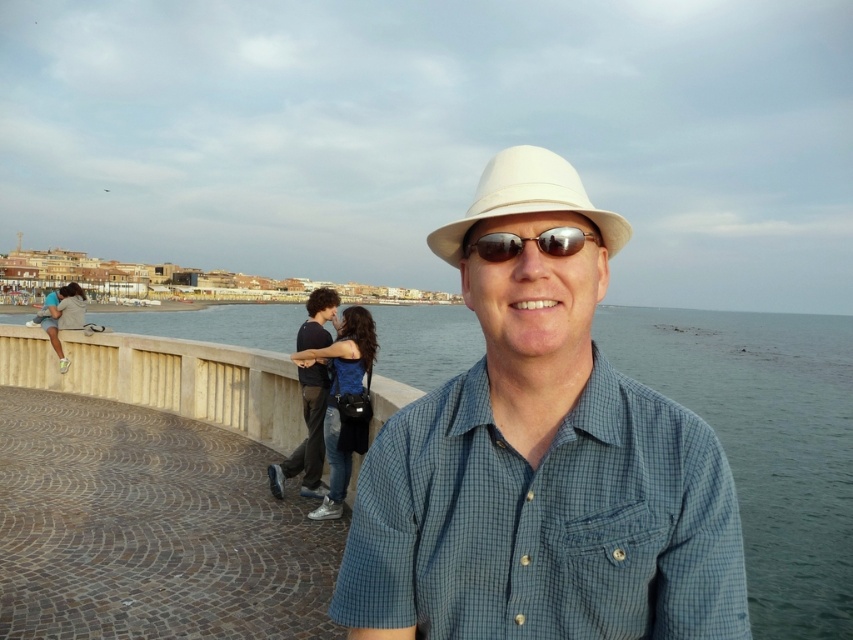
Can you confirm if white matte hat at center is wider than clear blue water at center?

In fact, white matte hat at center might be narrower than clear blue water at center.

Can you confirm if white matte hat at center is positioned to the left of clear blue water at center?

Correct, you'll find white matte hat at center to the left of clear blue water at center.

What do you see at coordinates (541, 461) in the screenshot? The height and width of the screenshot is (640, 853). I see `white matte hat at center` at bounding box center [541, 461].

The height and width of the screenshot is (640, 853). Identify the location of white matte hat at center. (541, 461).

Can you confirm if dark blue jeans at center is bigger than sunglasses at center?

Indeed, dark blue jeans at center has a larger size compared to sunglasses at center.

Does dark blue jeans at center have a lesser width compared to sunglasses at center?

In fact, dark blue jeans at center might be wider than sunglasses at center.

Is point (321, 289) more distant than point (544, 248)?

That is True.

Find the location of a particular element. The height and width of the screenshot is (640, 853). dark blue jeans at center is located at coordinates (306, 436).

In the scene shown: Is clear blue water at center shorter than dark blue jeans at center?

Incorrect, clear blue water at center's height does not fall short of dark blue jeans at center's.

Is clear blue water at center bigger than dark blue jeans at center?

Correct, clear blue water at center is larger in size than dark blue jeans at center.

Does point (206, 332) come closer to viewer compared to point (309, 346)?

That is False.

This screenshot has width=853, height=640. I want to click on clear blue water at center, so click(x=764, y=442).